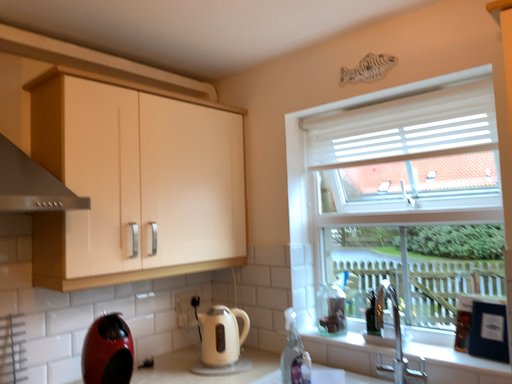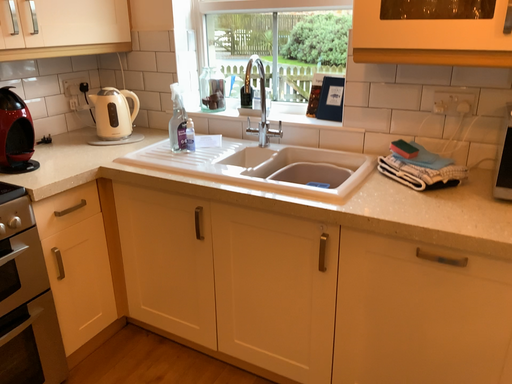
Question: Which way did the camera rotate in the video?

Choices:
 (A) rotated upward
 (B) rotated downward

Answer: (B)